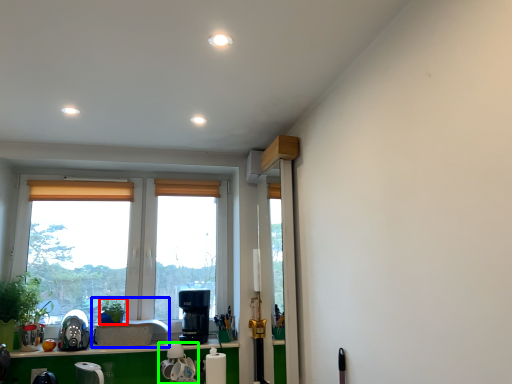
Question: Based on their relative distances, which object is nearer to plant (highlighted by a red box)? Choose from sink (highlighted by a blue box) and appliance (highlighted by a green box).

Choices:
 (A) sink
 (B) appliance

Answer: (A)